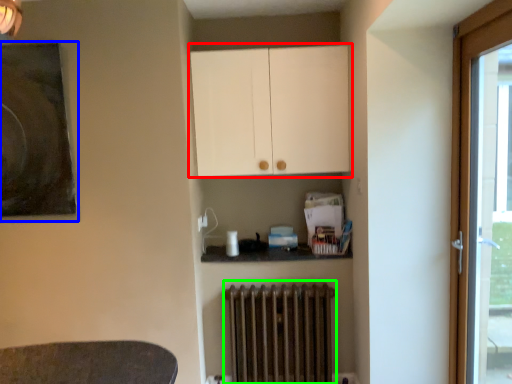
Question: Considering the real-world distances, which object is closest to cabinetry (highlighted by a red box)? picture frame (highlighted by a blue box) or radiator (highlighted by a green box).

Choices:
 (A) picture frame
 (B) radiator

Answer: (B)